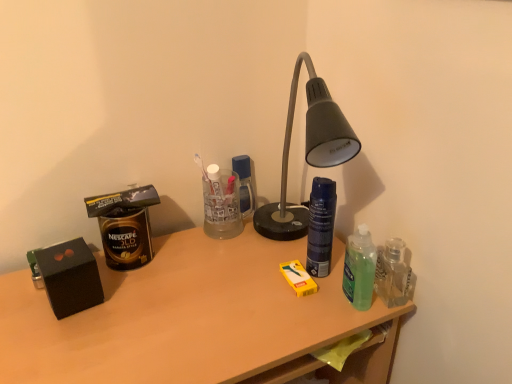
Where is `free space behind shiny dark blue spray can at center-right`? This screenshot has height=384, width=512. free space behind shiny dark blue spray can at center-right is located at coordinates (297, 238).